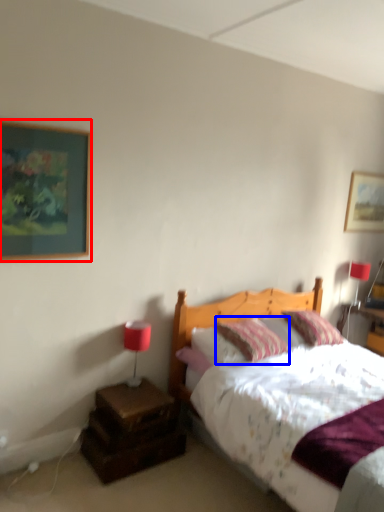
Question: Which of the following is the farthest to the observer, picture frame (highlighted by a red box) or pillow (highlighted by a blue box)?

Choices:
 (A) picture frame
 (B) pillow

Answer: (B)